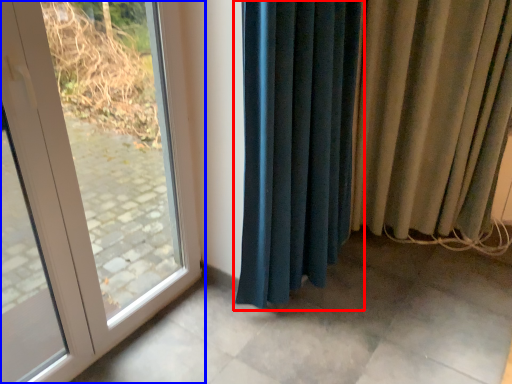
Question: Which object is further to the camera taking this photo, curtain (highlighted by a red box) or door (highlighted by a blue box)?

Choices:
 (A) curtain
 (B) door

Answer: (A)